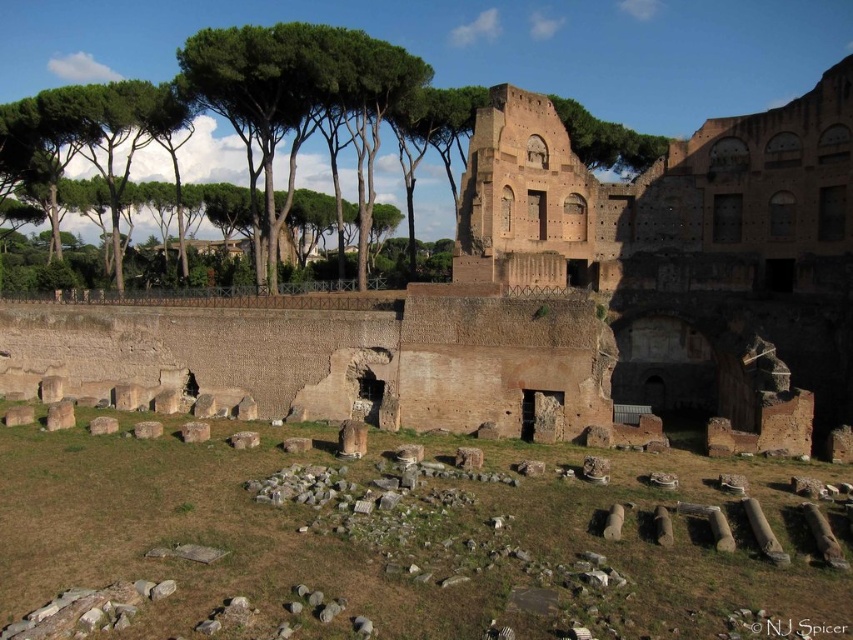
You are an archaeologist examining the ancient Roman ruin. You notice the brown brick amphitheater at center and the transparent watermark at upper center. Which object is wider?

The brown brick amphitheater at center is wider than the transparent watermark at upper center.

You are standing at the point marked by point (554,291) in the image. What is the name of the structure you are currently standing on?

The point 0.456, 051 marks the brown brick amphitheater at center, so you are standing on the brown brick amphitheater at center.